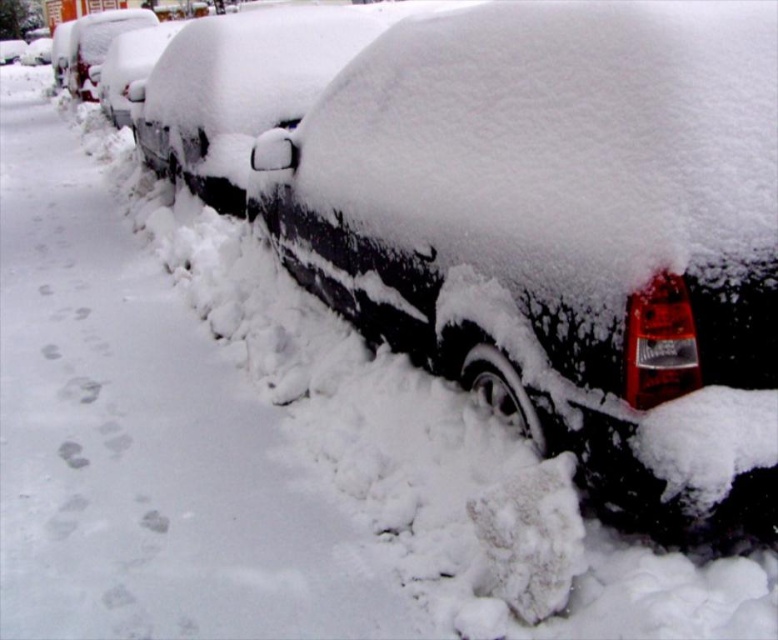
Between point (675, 209) and point (83, 83), which one is positioned in front?

Point (675, 209) is more forward.

Is black matte car at center wider than snow-covered car at upper left?

Yes, black matte car at center is wider than snow-covered car at upper left.

Between point (691, 74) and point (124, 32), which one is positioned in front?

Point (691, 74) is in front.

This screenshot has height=640, width=778. Find the location of `black matte car at center`. black matte car at center is located at coordinates (563, 232).